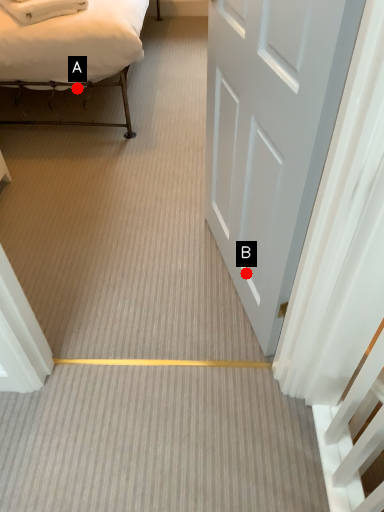
Question: Two points are circled on the image, labeled by A and B beside each circle. Which point is closer to the camera taking this photo?

Choices:
 (A) A is closer
 (B) B is closer

Answer: (B)